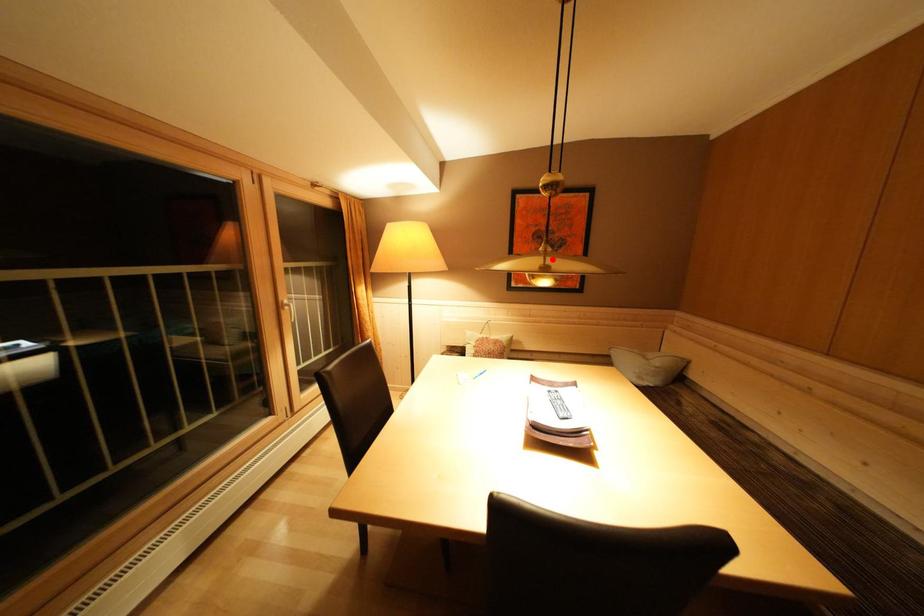
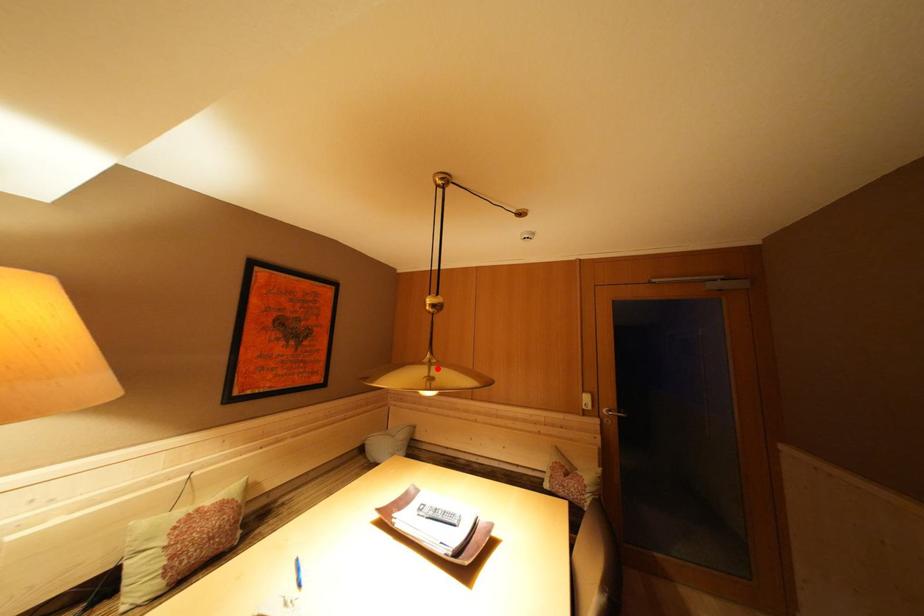
I am providing you with two images of the same scene from different viewpoints. A red point is marked on the first image and another point is marked on the second image. Is the red point in image1 aligned with the point shown in image2?

Yes